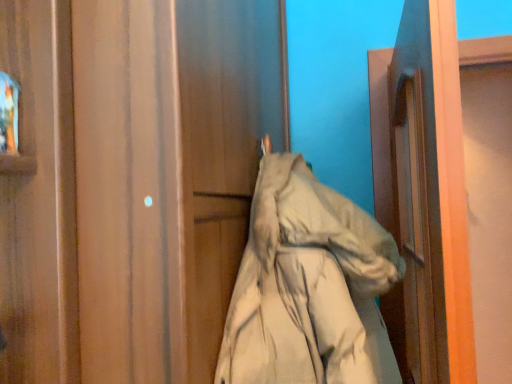
Question: From a real-world perspective, is matte wood door at center physically above printed fabric at upper left?

Choices:
 (A) yes
 (B) no

Answer: (B)

Question: Is matte wood door at center aimed at printed fabric at upper left?

Choices:
 (A) yes
 (B) no

Answer: (B)

Question: From the image's perspective, is matte wood door at center below printed fabric at upper left?

Choices:
 (A) no
 (B) yes

Answer: (B)

Question: From a real-world perspective, is matte wood door at center under printed fabric at upper left?

Choices:
 (A) yes
 (B) no

Answer: (A)

Question: Can you confirm if matte wood door at center is smaller than printed fabric at upper left?

Choices:
 (A) no
 (B) yes

Answer: (A)

Question: Can you confirm if matte wood door at center is shorter than printed fabric at upper left?

Choices:
 (A) no
 (B) yes

Answer: (A)

Question: Does printed fabric at upper left have a smaller size compared to matte wood door at center?

Choices:
 (A) no
 (B) yes

Answer: (B)

Question: Would you say printed fabric at upper left contains matte wood door at center?

Choices:
 (A) no
 (B) yes

Answer: (A)

Question: Could you tell me if printed fabric at upper left is turned towards matte wood door at center?

Choices:
 (A) no
 (B) yes

Answer: (A)

Question: Is printed fabric at upper left thinner than matte wood door at center?

Choices:
 (A) yes
 (B) no

Answer: (A)

Question: Considering the relative positions of printed fabric at upper left and matte wood door at center in the image provided, is printed fabric at upper left in front of matte wood door at center?

Choices:
 (A) no
 (B) yes

Answer: (A)

Question: Can you confirm if printed fabric at upper left is positioned to the right of matte wood door at center?

Choices:
 (A) yes
 (B) no

Answer: (B)

Question: Is matte wood door at center taller than beige fabric coat at center?

Choices:
 (A) no
 (B) yes

Answer: (B)